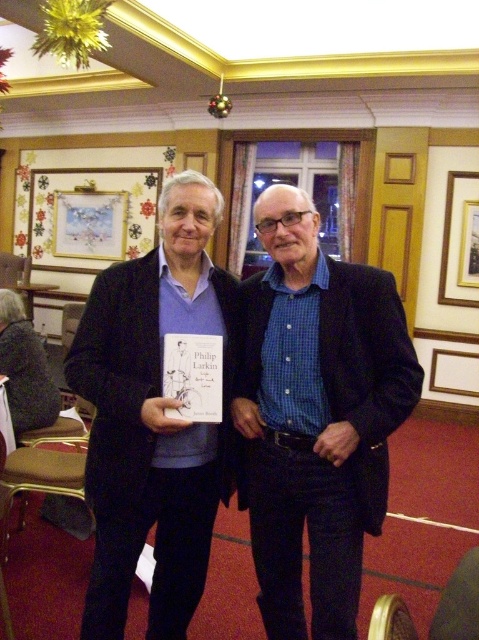
Can you confirm if matte black book at center is bigger than hardcover book at center?

Yes, matte black book at center is bigger than hardcover book at center.

Who is shorter, matte black book at center or hardcover book at center?

Standing shorter between the two is hardcover book at center.

Between point (121, 273) and point (178, 371), which one is positioned behind?

Point (121, 273)

Image resolution: width=479 pixels, height=640 pixels. What are the coordinates of `matte black book at center` in the screenshot? It's located at (243, 413).

In the scene shown: Is wooden picture frame at upper left bigger than hardcover book at center?

Correct, wooden picture frame at upper left is larger in size than hardcover book at center.

Which of these two, wooden picture frame at upper left or hardcover book at center, stands taller?

With more height is wooden picture frame at upper left.

Is point (91, 172) closer to camera compared to point (172, 342)?

No, it is behind (172, 342).

The width and height of the screenshot is (479, 640). I want to click on wooden picture frame at upper left, so click(x=91, y=216).

Is hardcover book at center closer to camera compared to gold metallic picture frame at upper right?

Yes, it is in front of gold metallic picture frame at upper right.

Can you confirm if hardcover book at center is positioned to the right of gold metallic picture frame at upper right?

In fact, hardcover book at center is to the left of gold metallic picture frame at upper right.

Describe the element at coordinates (193, 376) in the screenshot. I see `hardcover book at center` at that location.

This screenshot has width=479, height=640. I want to click on hardcover book at center, so [193, 376].